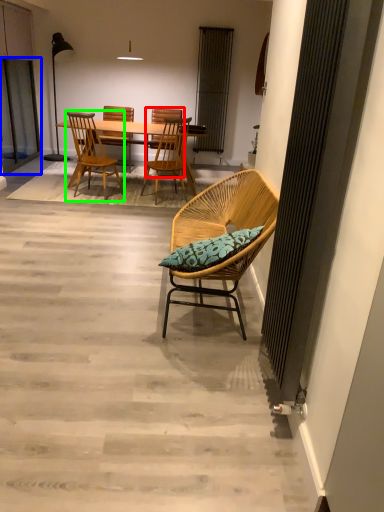
Question: Which object is the farthest from beach chair (highlighted by a red box)? Choose among these: screen door (highlighted by a blue box) or chair (highlighted by a green box).

Choices:
 (A) screen door
 (B) chair

Answer: (A)